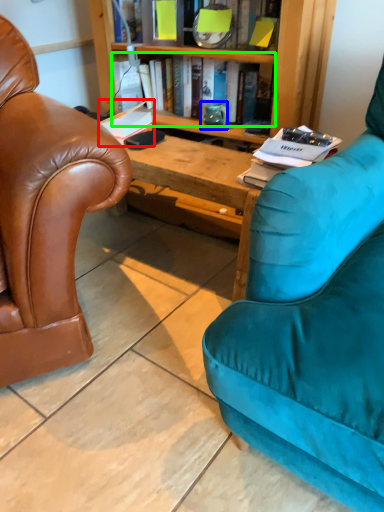
Question: Which is farther away from book (highlighted by a red box)? teal (highlighted by a blue box) or book (highlighted by a green box)?

Choices:
 (A) teal
 (B) book

Answer: (B)